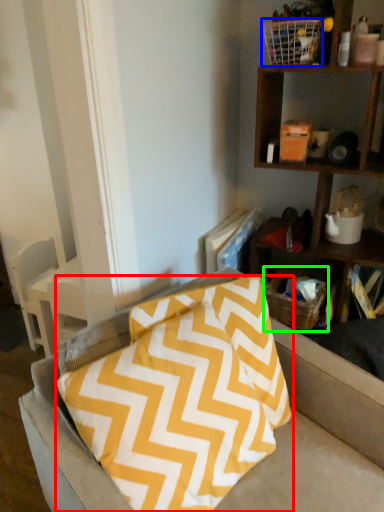
Question: Considering the real-world distances, which object is farthest from pillow (highlighted by a red box)? basket (highlighted by a blue box) or basket (highlighted by a green box)?

Choices:
 (A) basket
 (B) basket

Answer: (A)